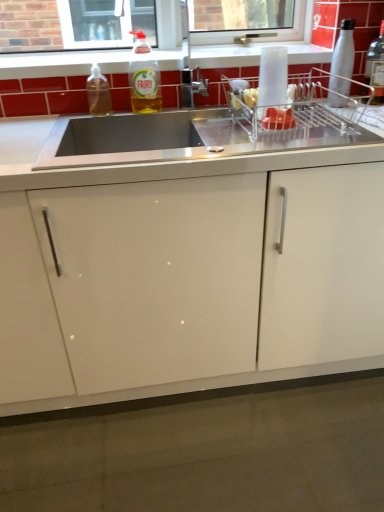
Find the location of `free space to the right of translucent plastic bottle at upper center, which is the 3th bottle from right to left`. free space to the right of translucent plastic bottle at upper center, which is the 3th bottle from right to left is located at coordinates (183, 109).